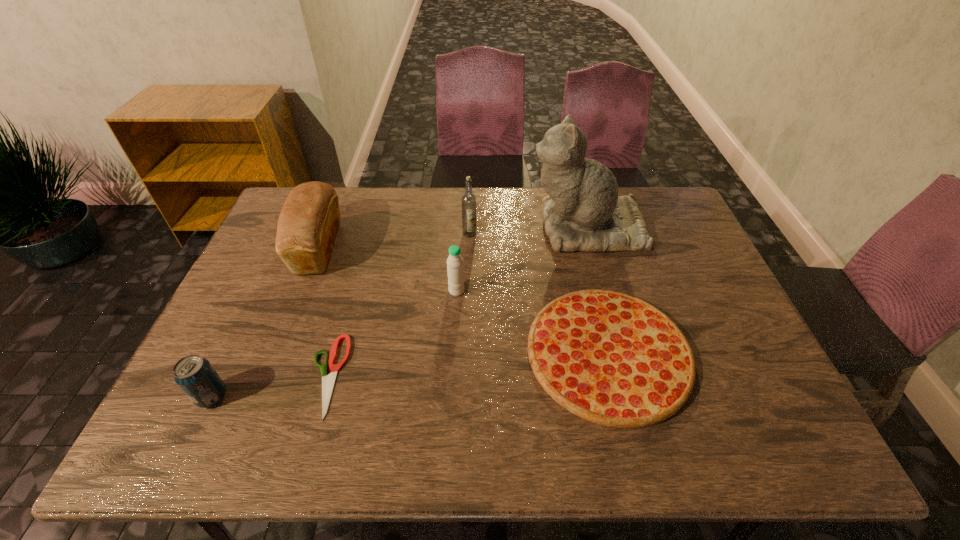
Identify the location of free space at the far left corner of the desktop. (273, 222).

The height and width of the screenshot is (540, 960). What are the coordinates of `vacant space at the near left corner of the desktop` in the screenshot? It's located at (211, 444).

Where is `free spot at the near right corner of the desktop`? Image resolution: width=960 pixels, height=540 pixels. free spot at the near right corner of the desktop is located at coordinates (773, 434).

Find the location of a particular element. The width and height of the screenshot is (960, 540). free space between the water bottle and the scissors is located at coordinates (392, 333).

Identify the location of blank region between the cat and the vodka. (528, 230).

Identify the location of unoccupied area between the sixth object from right to left and the third shortest object. The height and width of the screenshot is (540, 960). (265, 322).

This screenshot has height=540, width=960. In order to click on empty space that is in between the sixth tallest object and the vodka in this screenshot , I will do `click(539, 293)`.

Find the location of a particular element. free space between the water bottle and the bread is located at coordinates (387, 269).

Where is `free spot between the tallest object and the water bottle`? The height and width of the screenshot is (540, 960). free spot between the tallest object and the water bottle is located at coordinates (522, 259).

Identify the location of free space that is in between the bread and the pop soda. (265, 322).